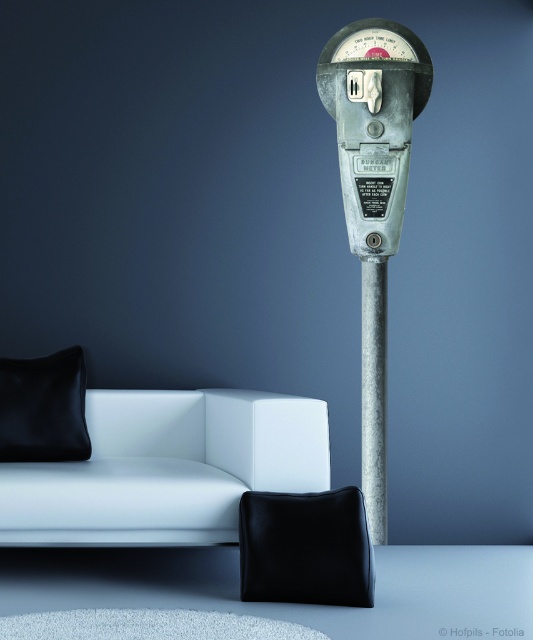
You are standing in the room and want to know how far the point at coordinates (344, 132) is from you. Can you determine the distance?

The point at coordinates (344, 132) is 3.86 meters from the viewer.

You are sitting on the white sofa and want to grab the black leather pillow at lower left. Is the black leather cushion at lower center in your way?

The black leather cushion at lower center is positioned under the black leather pillow at lower left, so it is not in your way when reaching for the pillow.

You are standing in the room and want to move from the white leather couch at lower left to the metallic textured pole at center. Which direction should you move towards?

The white leather couch at lower left is to the left of the metallic textured pole at center, so you should move towards the right to reach the pole.